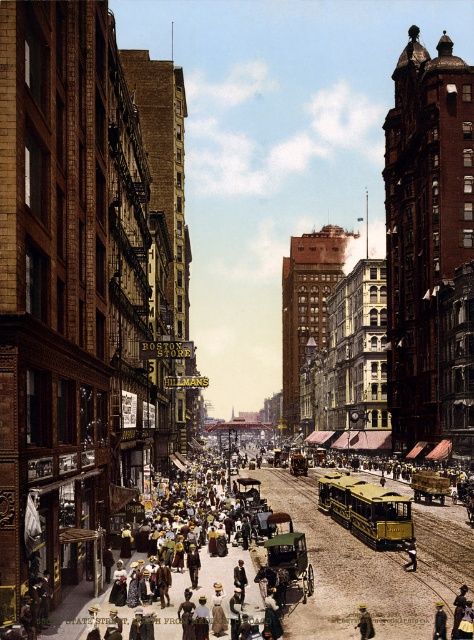
Question: Does light brown leather hat at center appear under yellow felt hat at center?

Choices:
 (A) yes
 (B) no

Answer: (A)

Question: Among these points, which one is farthest from the camera?

Choices:
 (A) (238, 595)
 (B) (410, 560)
 (C) (439, 612)

Answer: (B)

Question: Which point is closer to the camera?

Choices:
 (A) yellow cotton dress at center
 (B) yellow felt hat at center
 (C) leather jacket at center
 (D) light brown leather hat at center

Answer: (A)

Question: Is yellow felt hat at center below leather jacket at center?

Choices:
 (A) yes
 (B) no

Answer: (B)

Question: Which of the following is the farthest from the observer?

Choices:
 (A) yellow felt hat at center
 (B) yellow cotton dress at center
 (C) leather jacket at center
 (D) light brown leather hat at center

Answer: (C)

Question: From the image, what is the correct spatial relationship of yellow cotton dress at center in relation to light brown leather hat at center?

Choices:
 (A) above
 (B) below

Answer: (B)